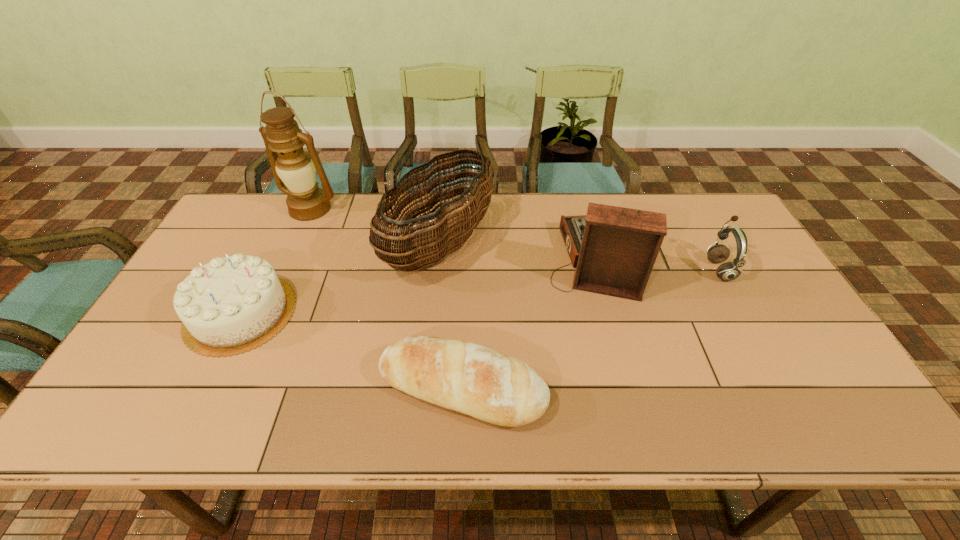
Where is `free space located 0.100m on the ear pads of the earphone`? free space located 0.100m on the ear pads of the earphone is located at coordinates (674, 269).

At what (x,y) coordinates should I click in order to perform the action: click on vacant region located on the ear pads of the earphone. Please return your answer as a coordinate pair (x, y). This screenshot has width=960, height=540. Looking at the image, I should click on (677, 269).

This screenshot has height=540, width=960. Identify the location of free space located on the right of the birthday cake. (437, 313).

You are a GUI agent. You are given a task and a screenshot of the screen. Output one action in this format:
    pyautogui.click(x=<x>, y=<y>)
    Task: Click on the free location located 0.050m on the right of the shortest object
    Image resolution: width=960 pixels, height=540 pixels.
    Given the screenshot: What is the action you would take?
    pyautogui.click(x=568, y=387)

Where is `oil lamp that is at the far edge`? The width and height of the screenshot is (960, 540). oil lamp that is at the far edge is located at coordinates (295, 168).

Find the location of a particular element. This screenshot has height=540, width=960. phonograph record present at the far edge is located at coordinates (614, 248).

Identify the location of basket situated at the far edge. (437, 238).

This screenshot has height=540, width=960. Find the location of `object that is at the near edge`. object that is at the near edge is located at coordinates (458, 375).

This screenshot has width=960, height=540. I want to click on oil lamp located at the left edge, so click(295, 168).

You are a GUI agent. You are given a task and a screenshot of the screen. Output one action in this format:
    pyautogui.click(x=<x>, y=<y>)
    Task: Click on the birthday cake that is positioned at the left edge
    The height and width of the screenshot is (540, 960).
    Given the screenshot: What is the action you would take?
    pyautogui.click(x=231, y=305)